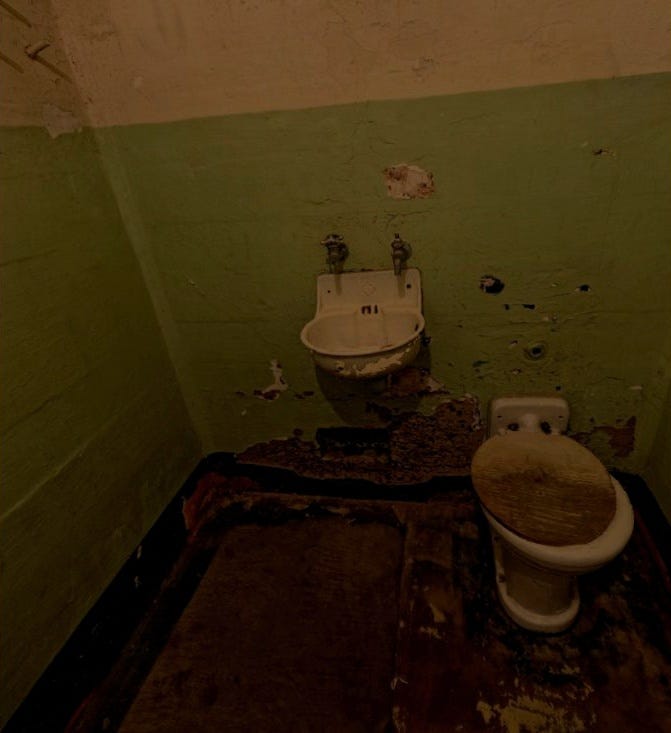
The image size is (671, 733). Find the location of `toilet cover`. toilet cover is located at coordinates (552, 495).